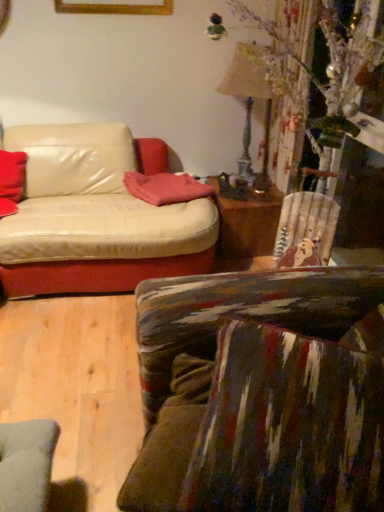
Identify the location of free space above wooden table at center (from a real-world perspective). point(252,190).